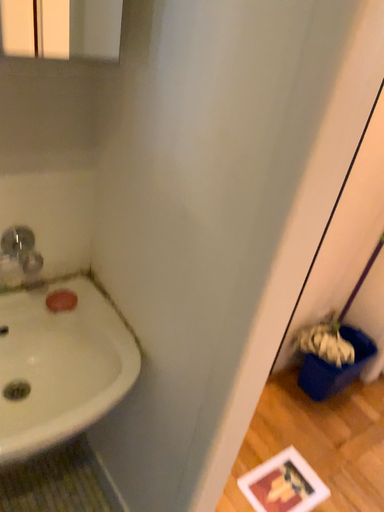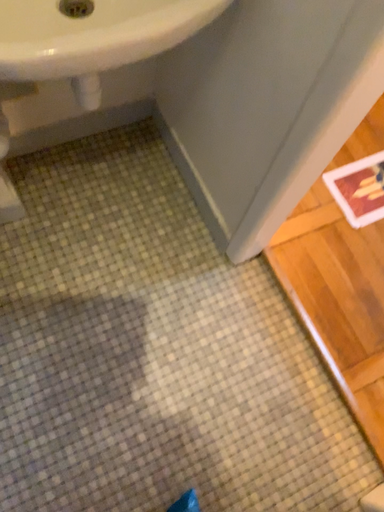
Question: How did the camera likely rotate when shooting the video?

Choices:
 (A) rotated left
 (B) rotated right

Answer: (A)